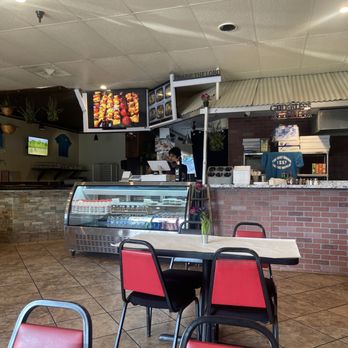
The image size is (348, 348). I want to click on food menu on screen, so click(160, 103).